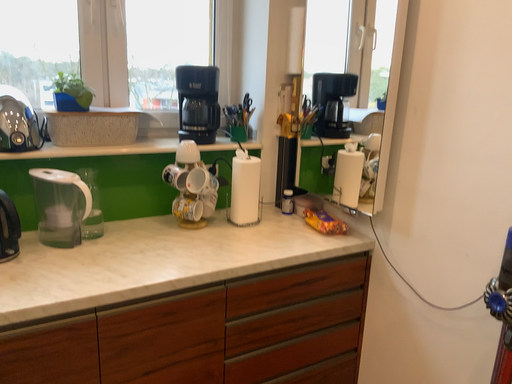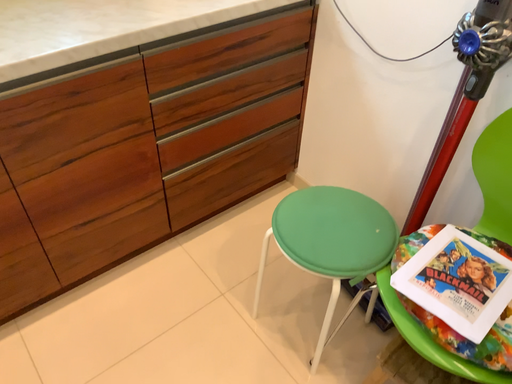
Question: Which way did the camera rotate in the video?

Choices:
 (A) rotated upward
 (B) rotated downward

Answer: (B)